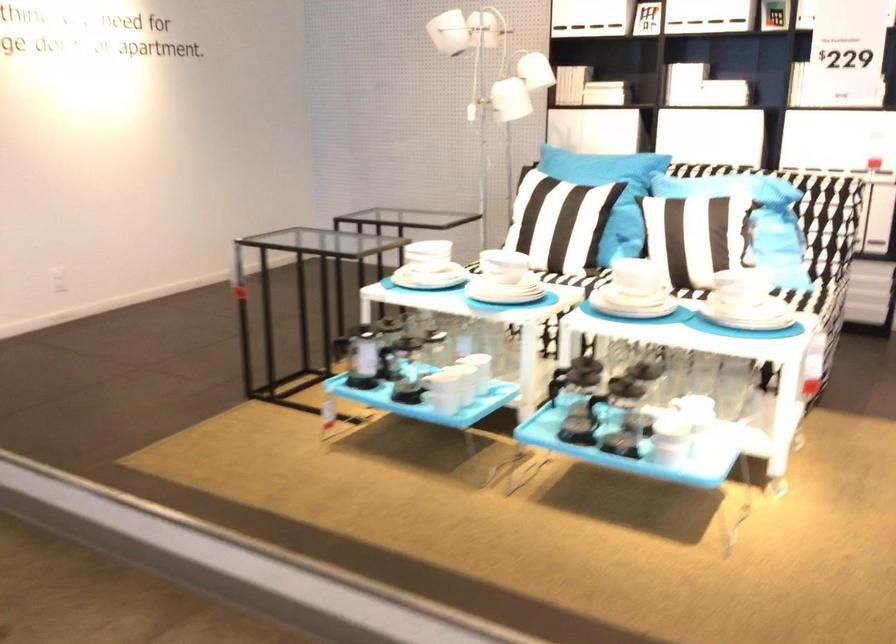
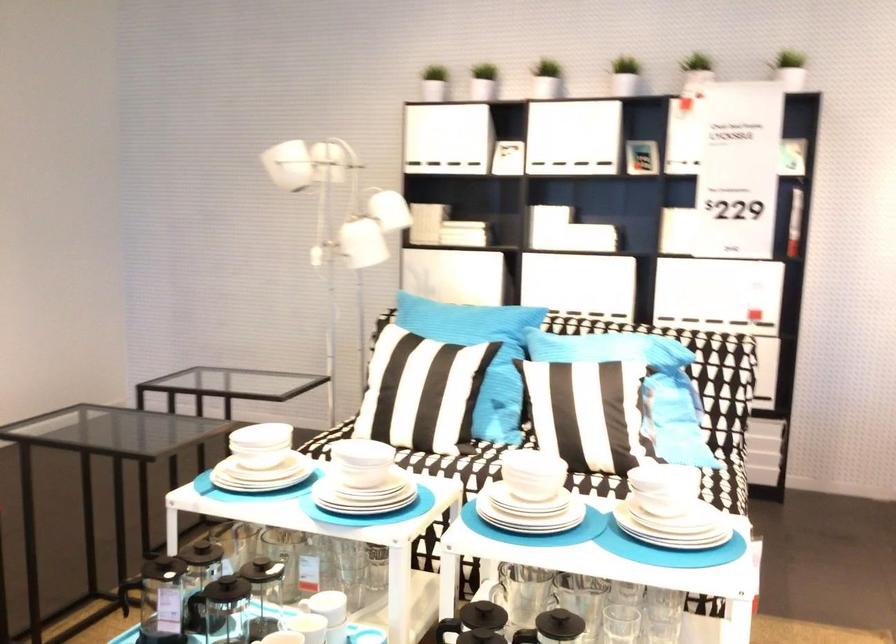
Where in the second image is the point corresponding to (696,223) from the first image?

(583, 404)